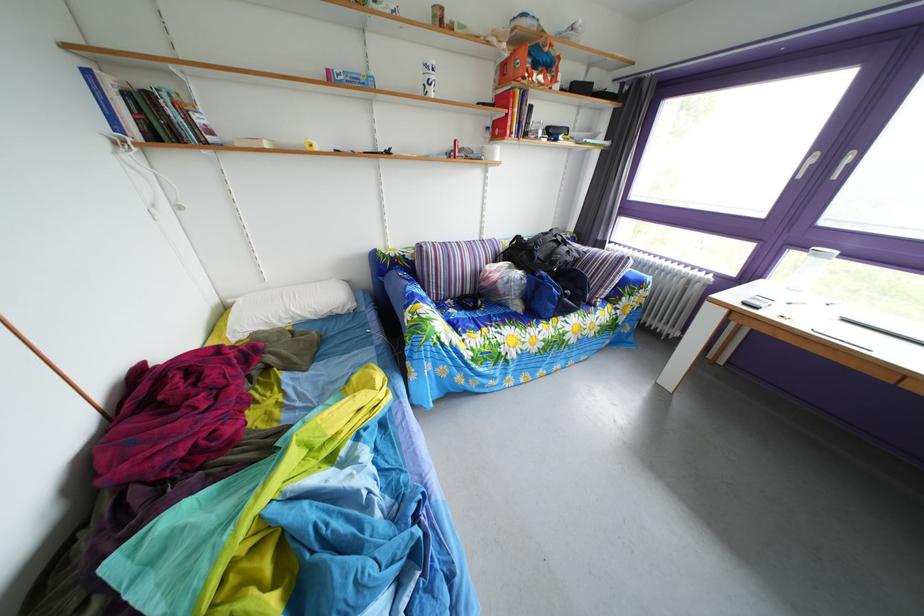
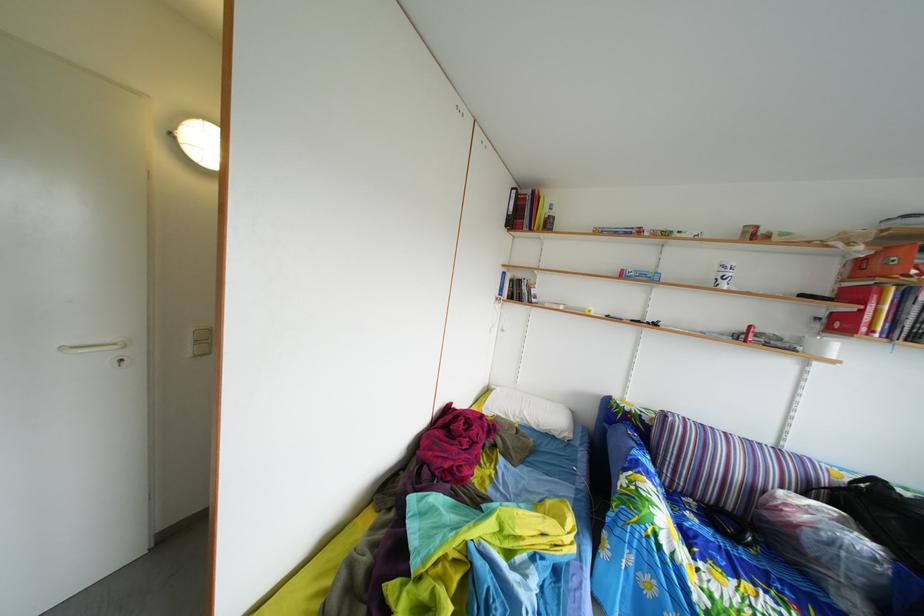
Question: The camera is either moving clockwise (left) or counter-clockwise (right) around the object. The first image is from the beginning of the video and the second image is from the end. Is the camera moving left or right when shooting the video?

Choices:
 (A) Left
 (B) Right

Answer: (B)